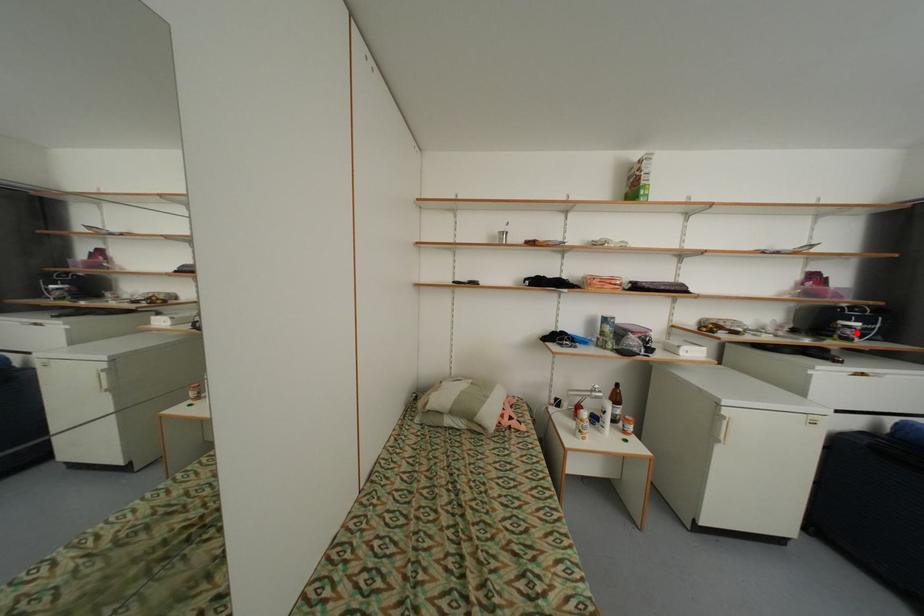
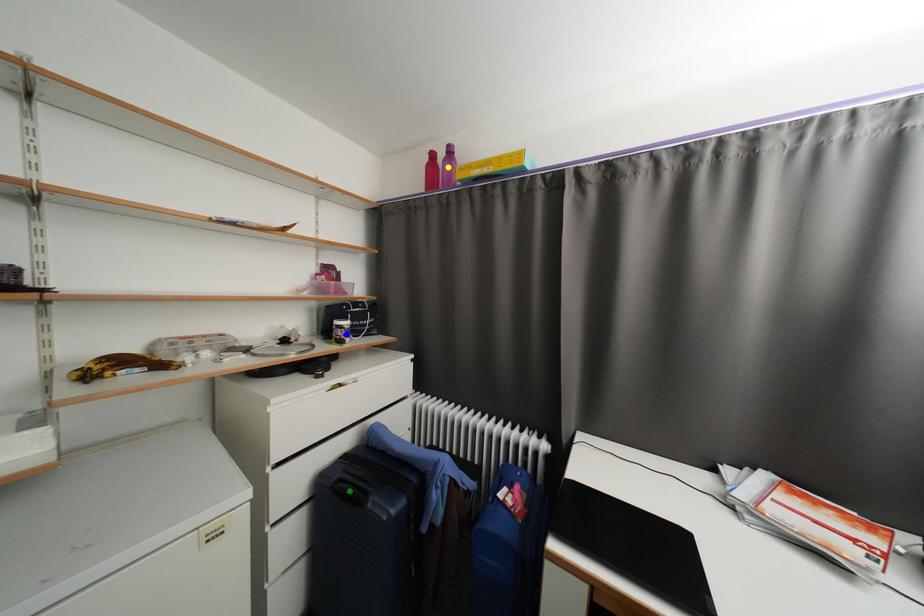
Question: I am providing you with two images of the same scene from different viewpoints. A red point is marked on the first image. You are given multiple points on the second image. In image 2, which mark is for the same physical point as the one in image 1?

Choices:
 (A) blue point
 (B) green point
 (C) yellow point

Answer: (A)